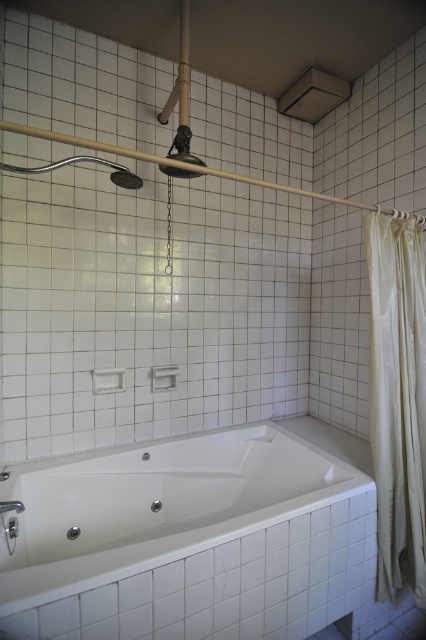
Question: Is white glossy bathtub at lower center below matte silver towel bar at center?

Choices:
 (A) no
 (B) yes

Answer: (B)

Question: Is polished chrome showerhead at upper center positioned at the back of white plastic towel bar at center?

Choices:
 (A) yes
 (B) no

Answer: (B)

Question: Which point appears farthest from the camera in this image?

Choices:
 (A) (138, 180)
 (B) (104, 385)

Answer: (B)

Question: Can you confirm if white plastic towel bar at center is bigger than matte silver towel bar at center?

Choices:
 (A) yes
 (B) no

Answer: (A)

Question: Which of the following is the closest to the observer?

Choices:
 (A) polished chrome showerhead at upper center
 (B) beige fabric shower curtain at right

Answer: (A)

Question: Which object is closer to the camera taking this photo?

Choices:
 (A) white glossy bathtub at lower center
 (B) white plastic towel bar at center
 (C) matte silver towel bar at center
 (D) beige fabric shower curtain at right

Answer: (A)